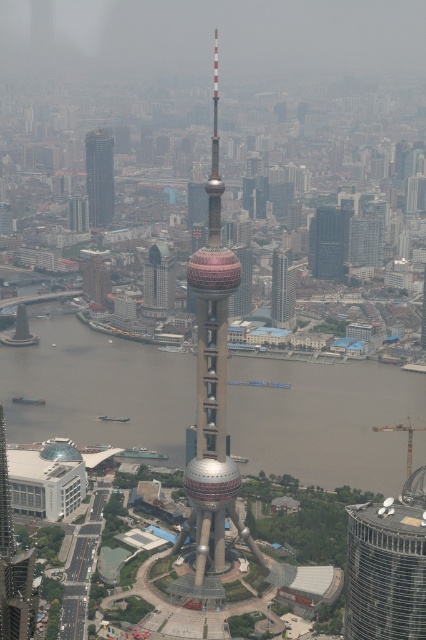
Question: Is gray concrete water at center closer to the viewer compared to glassy silver skyscraper at center?

Choices:
 (A) no
 (B) yes

Answer: (B)

Question: Among these points, which one is farthest from the camera?

Choices:
 (A) (97, 202)
 (B) (94, 298)

Answer: (A)

Question: Which object is positioned closest to the gray concrete water at center?

Choices:
 (A) glassy silver skyscraper at center
 (B) dark gray glass skyscraper at center
 (C) matte glass building at center-left
 (D) matte brown building at center-left

Answer: (C)

Question: Is dark gray glass skyscraper at center wider than matte glass building at center-left?

Choices:
 (A) yes
 (B) no

Answer: (A)

Question: Is shiny metallic tower at center below glassy silver skyscraper at center?

Choices:
 (A) no
 (B) yes

Answer: (B)

Question: Estimate the real-world distances between objects in this image. Which object is farther from the matte brown building at center-left?

Choices:
 (A) matte glass skyscraper at left
 (B) dark gray glass skyscraper at center
 (C) metallic silver tower at center
 (D) shiny metallic tower at center

Answer: (C)